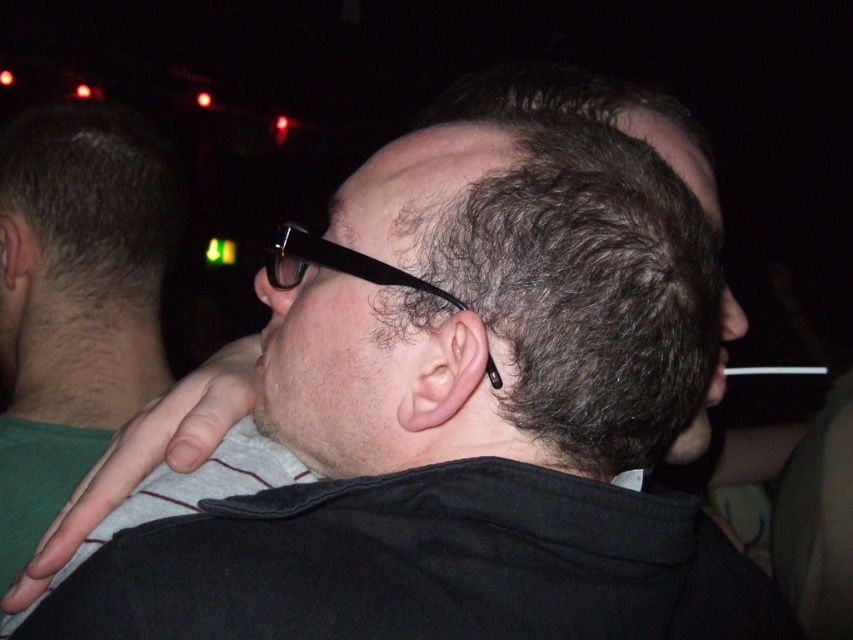
You are standing in a crowded room and notice two points of light in the distance. One is at coordinates point (447, 301) and the other at point (6, 220). Based on their positions, which point is closer to you?

Point (447, 301) is in front of point (6, 220), so it is closer to you.

You are a photographer trying to capture a close detail shot of the black plastic glasses at center and the black matte cigarette at center in the described scene. Since both are at the center, which object would you need to frame more tightly to ensure it fits within the camera viewfinder?

The black plastic glasses at center have a smaller width than the black matte cigarette at center, so you would need to frame the cigarette more tightly to accommodate its larger size within the viewfinder.